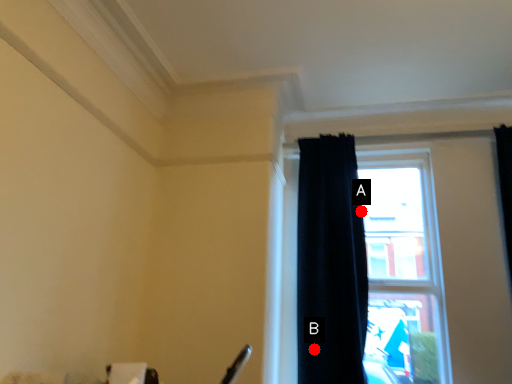
Question: Two points are circled on the image, labeled by A and B beside each circle. Which point is farther from the camera taking this photo?

Choices:
 (A) A is further
 (B) B is further

Answer: (A)